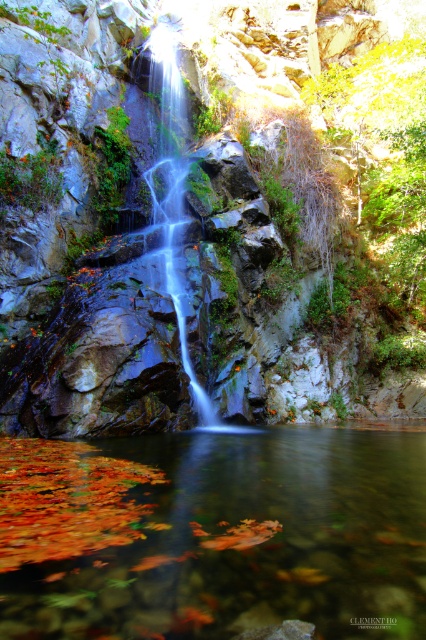
You are a hiker who wants to cross the pool at the bottom of the waterfall. You notice the translucent water at center and the translucent glass waterfall at center. Which one is shorter in height?

The translucent water at center is not as tall as the translucent glass waterfall at center, so the translucent water at center is shorter in height.